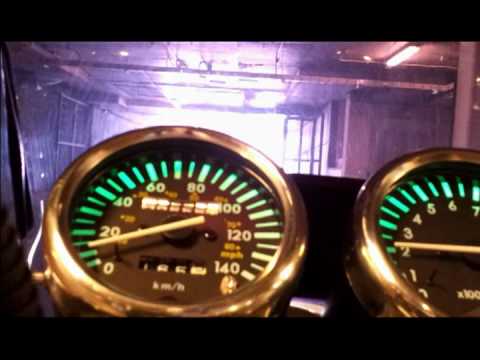
Where is `walls`? This screenshot has height=360, width=480. walls is located at coordinates (419, 133), (44, 128).